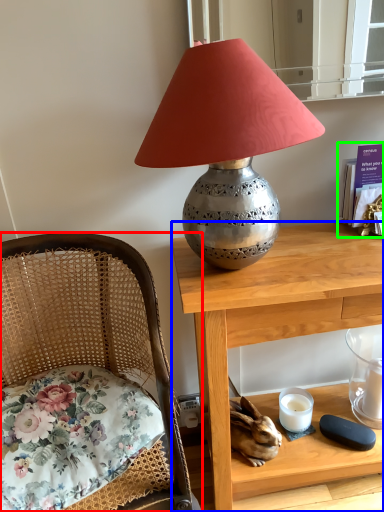
Question: Which object is the farthest from chair (highlighted by a red box)? Choose among these: desk (highlighted by a blue box) or book (highlighted by a green box).

Choices:
 (A) desk
 (B) book

Answer: (B)